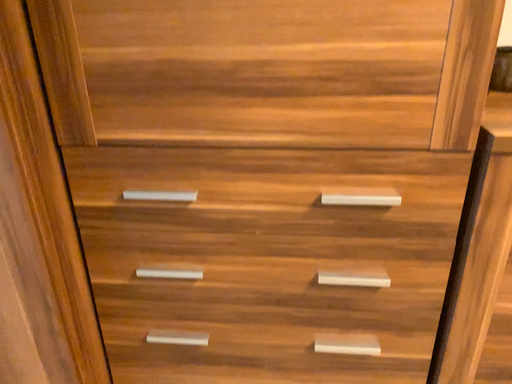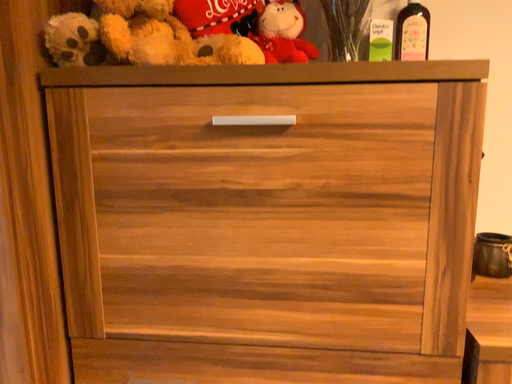
Question: How did the camera likely rotate when shooting the video?

Choices:
 (A) rotated upward
 (B) rotated downward

Answer: (A)